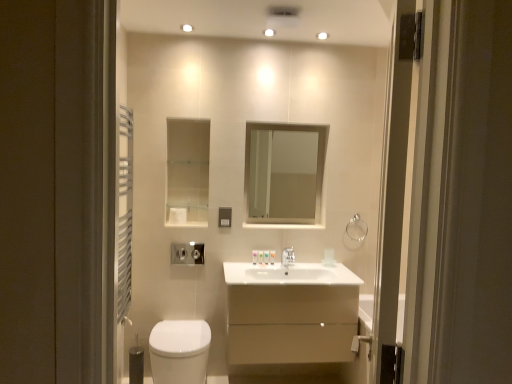
Where is `vacant area that lies in front of translucent plastic soap at center, which ranks as the third toiletry in left-to-right order`? The image size is (512, 384). vacant area that lies in front of translucent plastic soap at center, which ranks as the third toiletry in left-to-right order is located at coordinates (260, 266).